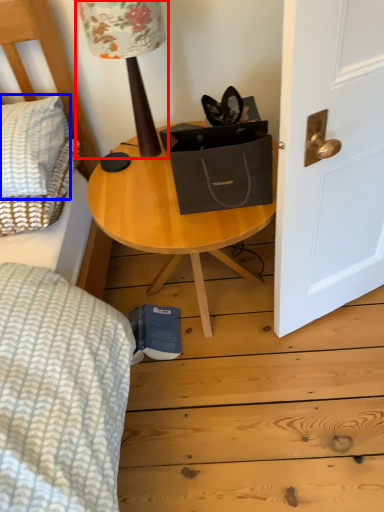
Question: Which object is further to the camera taking this photo, table lamp (highlighted by a red box) or pillow (highlighted by a blue box)?

Choices:
 (A) table lamp
 (B) pillow

Answer: (B)